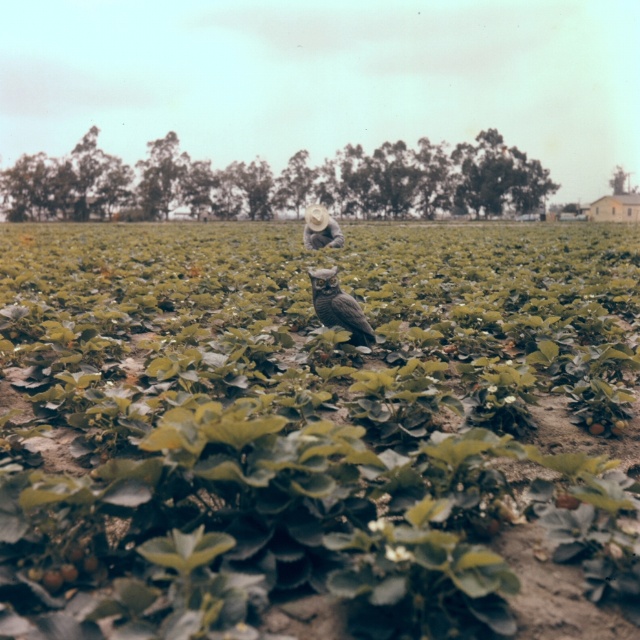
Question: Which object is positioned closest to the light brown straw hat at center?

Choices:
 (A) green matte plant at center
 (B) brown feathered owl at center

Answer: (A)

Question: Does green matte plant at center have a larger size compared to brown feathered owl at center?

Choices:
 (A) no
 (B) yes

Answer: (B)

Question: Among these points, which one is nearest to the camera?

Choices:
 (A) (358, 333)
 (B) (314, 209)

Answer: (A)

Question: Is green matte plant at center to the right of brown feathered owl at center from the viewer's perspective?

Choices:
 (A) no
 (B) yes

Answer: (A)

Question: Which of the following is the farthest from the observer?

Choices:
 (A) (337, 301)
 (B) (310, 240)

Answer: (B)

Question: Considering the relative positions of green matte plant at center and brown feathered owl at center in the image provided, where is green matte plant at center located with respect to brown feathered owl at center?

Choices:
 (A) right
 (B) left

Answer: (B)